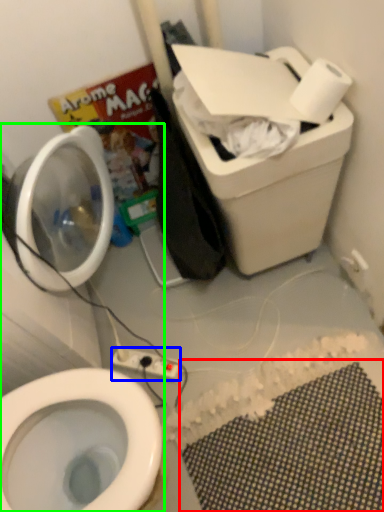
Question: Considering the real-world distances, which object is closest to bath mat (highlighted by a red box)? electric outlet (highlighted by a blue box) or toiletries (highlighted by a green box).

Choices:
 (A) electric outlet
 (B) toiletries

Answer: (A)